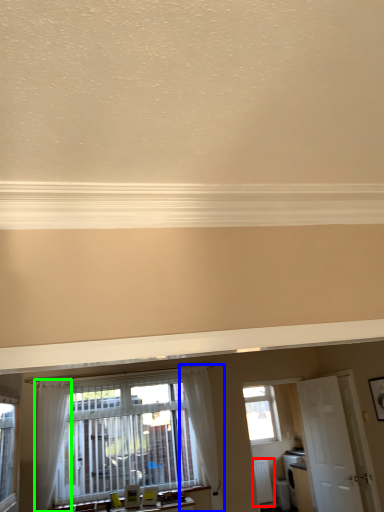
Question: Estimate the real-world distances between objects in this image. Which object is closer to radiator (highlighted by a red box), curtain (highlighted by a blue box) or curtain (highlighted by a green box)?

Choices:
 (A) curtain
 (B) curtain

Answer: (A)